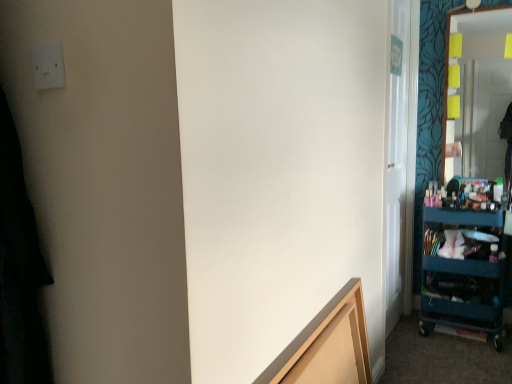
Measure the distance between transparent glass door at right and camera.

transparent glass door at right and camera are 6.62 feet apart.

The image size is (512, 384). In order to click on teal plastic cart at right in this screenshot , I will do `click(463, 268)`.

The height and width of the screenshot is (384, 512). Identify the location of matte glass mirror at right. (447, 70).

Can you tell me how much teal plastic cart at right and white plastic electric outlet at upper left differ in facing direction?

They differ by 0.0528 degrees in their facing directions.

At what (x,y) coordinates should I click in order to perform the action: click on electric outlet above the teal plastic cart at right (from the image's perspective). Please return your answer as a coordinate pair (x, y). This screenshot has height=384, width=512. Looking at the image, I should click on (48, 66).

Is teal plastic cart at right to the left of white plastic electric outlet at upper left from the viewer's perspective?

Incorrect, teal plastic cart at right is not on the left side of white plastic electric outlet at upper left.

Considering the relative positions of teal plastic cart at right and white plastic electric outlet at upper left in the image provided, is teal plastic cart at right in front of white plastic electric outlet at upper left?

No, teal plastic cart at right is behind white plastic electric outlet at upper left.

Between teal plastic cart at right and matte glass mirror at right, which one is positioned in front?

teal plastic cart at right is closer to the camera.

Can you tell me how much teal plastic cart at right and matte glass mirror at right differ in facing direction?

1.36 degrees.

Which object is thinner, teal plastic cart at right or matte glass mirror at right?

matte glass mirror at right.

Does teal plastic cart at right appear on the left side of matte glass mirror at right?

Indeed, teal plastic cart at right is positioned on the left side of matte glass mirror at right.

From the image's perspective, which one is positioned lower, transparent glass door at right or teal plastic cart at right?

teal plastic cart at right.

Looking at this image, considering the sizes of objects transparent glass door at right and teal plastic cart at right in the image provided, who is shorter, transparent glass door at right or teal plastic cart at right?

With less height is teal plastic cart at right.

Are transparent glass door at right and teal plastic cart at right far apart?

Actually, transparent glass door at right and teal plastic cart at right are a little close together.

Does transparent glass door at right come behind teal plastic cart at right?

No, it is not.

Between transparent glass door at right and white plastic electric outlet at upper left, which one has less height?

white plastic electric outlet at upper left is shorter.

From the image's perspective, is transparent glass door at right located above or below white plastic electric outlet at upper left?

transparent glass door at right is below white plastic electric outlet at upper left.

Are transparent glass door at right and white plastic electric outlet at upper left far apart?

Absolutely, transparent glass door at right is distant from white plastic electric outlet at upper left.

This screenshot has height=384, width=512. In order to click on electric outlet on the left of transparent glass door at right in this screenshot , I will do `click(48, 66)`.

Is transparent glass door at right next to matte glass mirror at right?

transparent glass door at right and matte glass mirror at right are clearly separated.

From the image's perspective, is transparent glass door at right over matte glass mirror at right?

No, from the image's perspective, transparent glass door at right is not over matte glass mirror at right.

Considering the relative sizes of transparent glass door at right and matte glass mirror at right in the image provided, is transparent glass door at right bigger than matte glass mirror at right?

Yes.

Relative to matte glass mirror at right, is transparent glass door at right in front or behind?

transparent glass door at right is in front of matte glass mirror at right.

Between light brown wood frame at lower center and transparent glass door at right, which one has smaller size?

Smaller between the two is light brown wood frame at lower center.

Does point (339, 356) come closer to viewer compared to point (389, 126)?

Yes.

Is light brown wood frame at lower center placed right next to transparent glass door at right?

No, light brown wood frame at lower center is not next to transparent glass door at right.

Visually, is matte glass mirror at right positioned to the left or to the right of transparent glass door at right?

matte glass mirror at right is positioned on transparent glass door at right's right side.

How different are the orientations of matte glass mirror at right and transparent glass door at right in degrees?

87.9 degrees separate the facing orientations of matte glass mirror at right and transparent glass door at right.

Consider the image. Is matte glass mirror at right in front of or behind transparent glass door at right in the image?

matte glass mirror at right is behind transparent glass door at right.

Is matte glass mirror at right inside or outside of transparent glass door at right?

matte glass mirror at right lies outside transparent glass door at right.

Where is `electric outlet above the teal plastic cart at right (from a real-world perspective)`? electric outlet above the teal plastic cart at right (from a real-world perspective) is located at coordinates (48, 66).

In the image, there is a matte glass mirror at right. What are the coordinates of `shelf below it (from the image's perspective)` in the screenshot? It's located at (463, 268).

When comparing their distances from matte glass mirror at right, does light brown wood frame at lower center or transparent glass door at right seem closer?

Based on the image, transparent glass door at right appears to be nearer to matte glass mirror at right.

From the image, which object appears to be farther from teal plastic cart at right, matte glass mirror at right or transparent glass door at right?

matte glass mirror at right is positioned further to the anchor teal plastic cart at right.

Looking at the image, which one is located further to matte glass mirror at right, teal plastic cart at right or white plastic electric outlet at upper left?

white plastic electric outlet at upper left lies further to matte glass mirror at right than the other object.

Estimate the real-world distances between objects in this image. Which object is closer to light brown wood frame at lower center, white plastic electric outlet at upper left or matte glass mirror at right?

white plastic electric outlet at upper left is positioned closer to the anchor light brown wood frame at lower center.

When comparing their distances from transparent glass door at right, does teal plastic cart at right or light brown wood frame at lower center seem further?

light brown wood frame at lower center lies further to transparent glass door at right than the other object.

Consider the image. Considering their positions, is matte glass mirror at right positioned closer to light brown wood frame at lower center than white plastic electric outlet at upper left?

white plastic electric outlet at upper left is closer to light brown wood frame at lower center.

Based on their spatial positions, is light brown wood frame at lower center or teal plastic cart at right closer to transparent glass door at right?

teal plastic cart at right is positioned closer to the anchor transparent glass door at right.

Which object lies further to the anchor point transparent glass door at right, white plastic electric outlet at upper left or teal plastic cart at right?

white plastic electric outlet at upper left lies further to transparent glass door at right than the other object.

The image size is (512, 384). I want to click on glass door located between light brown wood frame at lower center and teal plastic cart at right in the depth direction, so click(400, 162).

Locate an element on the screen. Image resolution: width=512 pixels, height=384 pixels. cabinetry between white plastic electric outlet at upper left and transparent glass door at right in the front-back direction is located at coordinates (324, 344).

Identify the location of glass door between white plastic electric outlet at upper left and teal plastic cart at right from left to right. The width and height of the screenshot is (512, 384). (400, 162).

This screenshot has width=512, height=384. In order to click on glass door situated between white plastic electric outlet at upper left and matte glass mirror at right from left to right in this screenshot , I will do `click(400, 162)`.